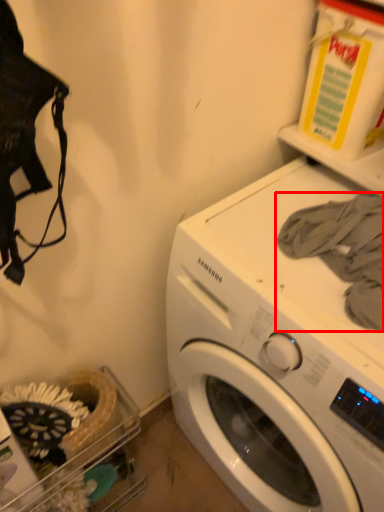
Question: Observing the image, what is the correct spatial positioning of clothing (annotated by the red box) in reference to washing machine?

Choices:
 (A) right
 (B) left

Answer: (B)